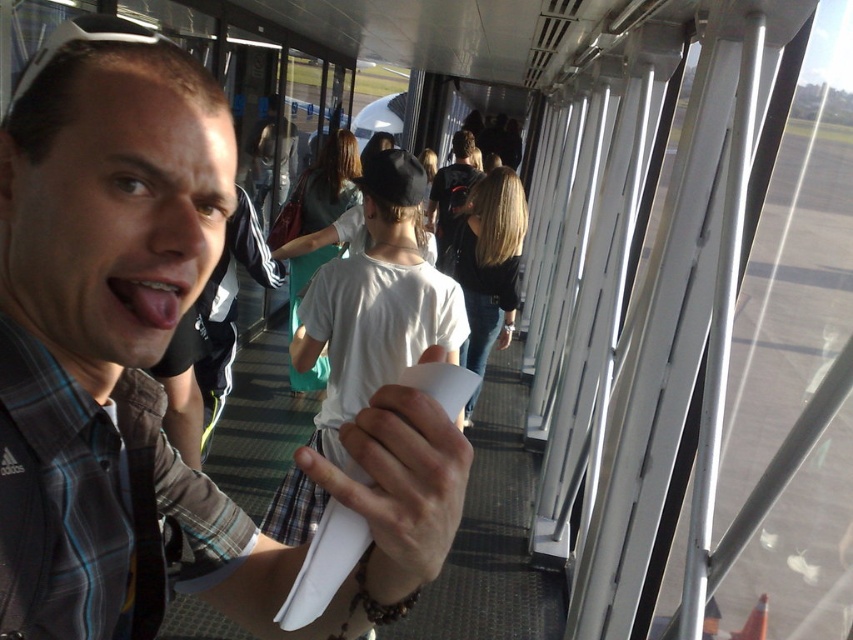
Question: Considering the real-world distances, which object is closest to the white matte shirt at center?

Choices:
 (A) white paper at center
 (B) pink glossy tongue at center

Answer: (A)

Question: Which point is farther to the camera?

Choices:
 (A) plaid shirt at left
 (B) white matte shirt at center
 (C) pink glossy tongue at center
 (D) white paper at center

Answer: (B)

Question: Which object appears closest to the camera in this image?

Choices:
 (A) white matte shirt at center
 (B) white paper at center
 (C) plaid shirt at left

Answer: (B)

Question: Is white matte shirt at center above white paper at center?

Choices:
 (A) yes
 (B) no

Answer: (A)

Question: Is plaid shirt at left further to the viewer compared to white matte shirt at center?

Choices:
 (A) no
 (B) yes

Answer: (A)

Question: Can you confirm if plaid shirt at left is thinner than white matte shirt at center?

Choices:
 (A) yes
 (B) no

Answer: (A)